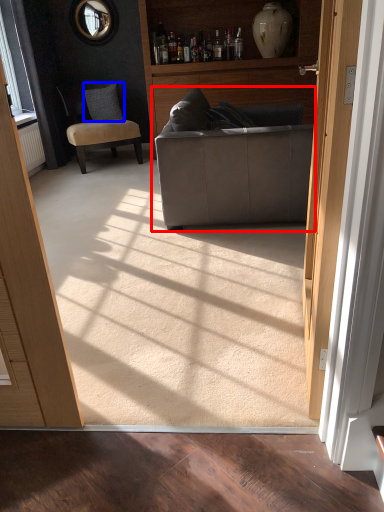
Question: Among these objects, which one is farthest to the camera, studio couch (highlighted by a red box) or pillow (highlighted by a blue box)?

Choices:
 (A) studio couch
 (B) pillow

Answer: (B)